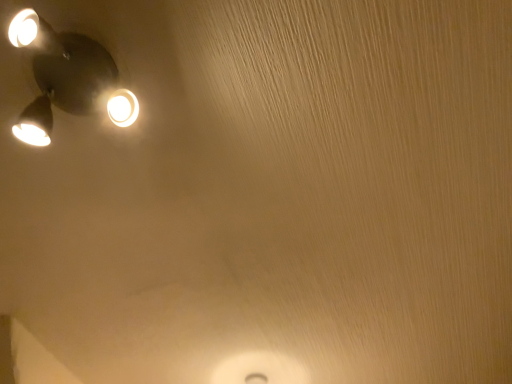
Question: Should I look upward or downward to see matte white lamp at upper left?

Choices:
 (A) down
 (B) up

Answer: (B)